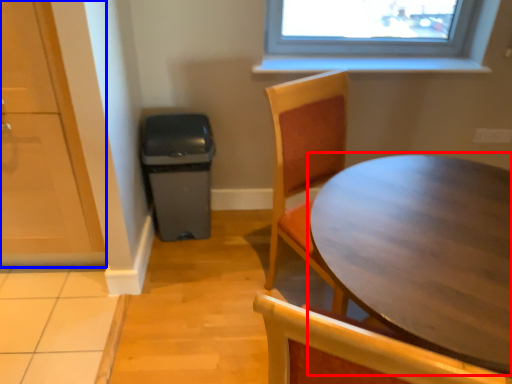
Question: Which point is further to the camera, table (highlighted by a red box) or screen door (highlighted by a blue box)?

Choices:
 (A) table
 (B) screen door

Answer: (B)